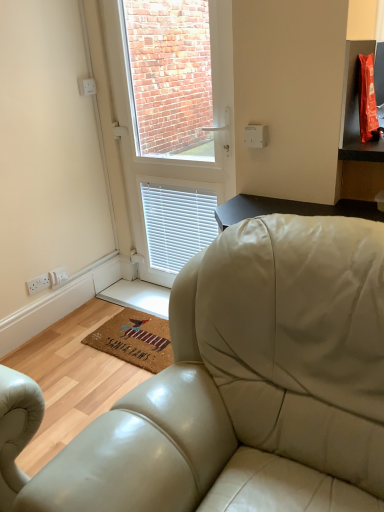
Question: Is white plastic window at center bigger than brown coir mat at lower center?

Choices:
 (A) no
 (B) yes

Answer: (B)

Question: Is white plastic window at center thinner than brown coir mat at lower center?

Choices:
 (A) yes
 (B) no

Answer: (A)

Question: Does white plastic window at center appear on the right side of brown coir mat at lower center?

Choices:
 (A) yes
 (B) no

Answer: (A)

Question: Is white plastic window at center positioned before brown coir mat at lower center?

Choices:
 (A) no
 (B) yes

Answer: (B)

Question: Is white plastic window at center positioned with its back to brown coir mat at lower center?

Choices:
 (A) yes
 (B) no

Answer: (B)

Question: In terms of width, does brown coir mat at lower center look wider or thinner when compared to white plastic socket at lower left?

Choices:
 (A) wide
 (B) thin

Answer: (A)

Question: From a real-world perspective, is brown coir mat at lower center positioned above or below white plastic socket at lower left?

Choices:
 (A) above
 (B) below

Answer: (B)

Question: From the image's perspective, is brown coir mat at lower center positioned above or below white plastic socket at lower left?

Choices:
 (A) above
 (B) below

Answer: (B)

Question: Is brown coir mat at lower center situated inside white plastic socket at lower left or outside?

Choices:
 (A) inside
 (B) outside

Answer: (B)

Question: Based on their positions, is white plastic socket at lower left located to the left or right of white plastic window at center?

Choices:
 (A) left
 (B) right

Answer: (A)

Question: Is white plastic socket at lower left situated inside white plastic window at center or outside?

Choices:
 (A) outside
 (B) inside

Answer: (A)

Question: Does point (44, 276) appear closer or farther from the camera than point (117, 34)?

Choices:
 (A) closer
 (B) farther

Answer: (B)

Question: Considering the positions of white plastic socket at lower left and white plastic window at center in the image, is white plastic socket at lower left wider or thinner than white plastic window at center?

Choices:
 (A) thin
 (B) wide

Answer: (A)

Question: Is brown coir mat at lower center situated inside white plastic window at center or outside?

Choices:
 (A) inside
 (B) outside

Answer: (B)

Question: Is brown coir mat at lower center to the left or to the right of white plastic window at center in the image?

Choices:
 (A) left
 (B) right

Answer: (A)